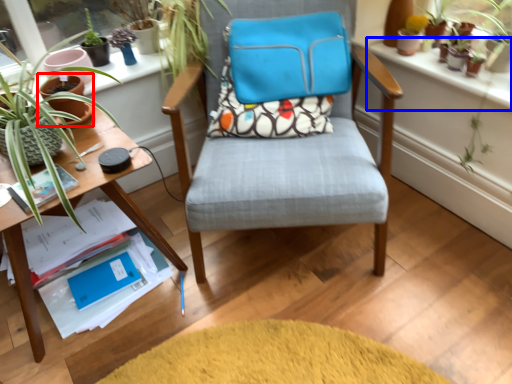
Question: Among these objects, which one is nearest to the camera, flowerpot (highlighted by a red box) or window sill (highlighted by a blue box)?

Choices:
 (A) flowerpot
 (B) window sill

Answer: (B)